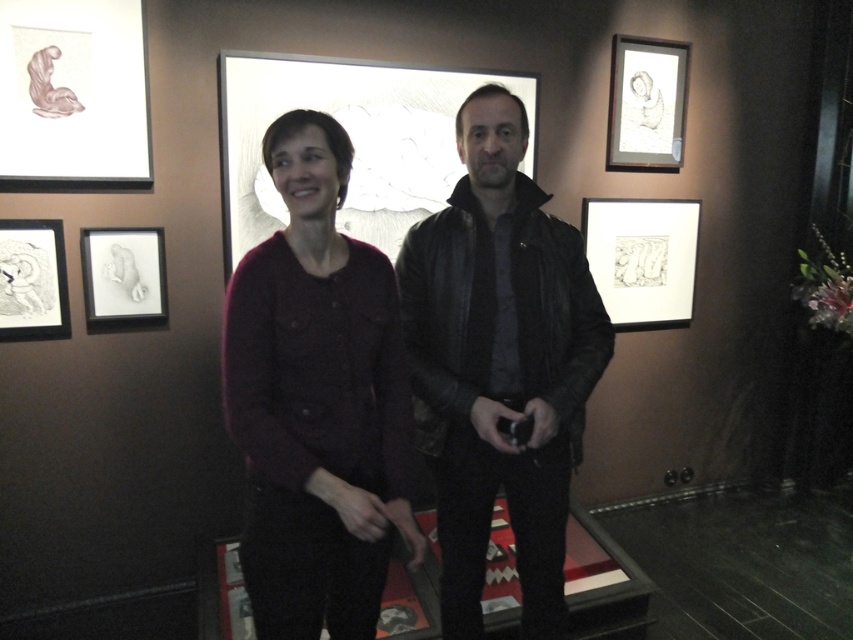
You are an art curator at the exhibition and need to adjust the lighting so that the matte black picture frame at upper right is illuminated more than the leather jacket at center. Based on their positions, which object is closer to the light source above?

The matte black picture frame at upper right is closer to the light source above because it is positioned higher than the leather jacket at center, which is located below it.

You are an artist trying to sketch the scene. You need to place the leather jacket at center in your drawing. According to the coordinates provided, where should you position it on your canvas?

The leather jacket at center should be positioned at coordinates point (498, 365) on the canvas.

You are an art curator arranging an exhibition. You have a matte paper drawing at upper left and a black matte picture frame at lower right. Based on their positions, which object is higher up in the image?

The matte paper drawing at upper left is located above the black matte picture frame at lower right, so it is higher up in the image.